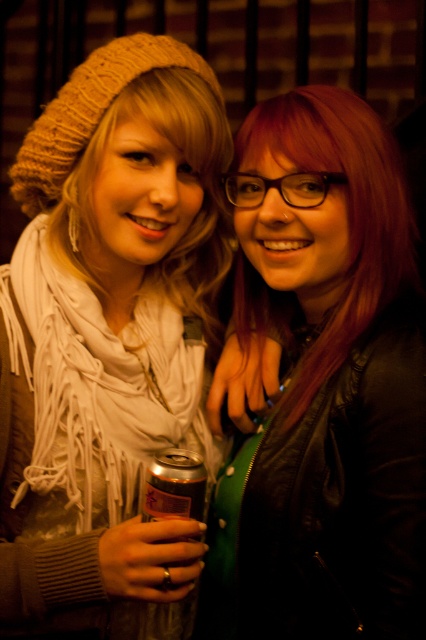
Is point (351, 148) less distant than point (178, 486)?

No, (351, 148) is further to viewer.

Who is more distant from viewer, (288, 352) or (154, 502)?

Point (288, 352)

This screenshot has height=640, width=426. In order to click on shiny black leather jacket at center in this screenshot , I will do coord(322,384).

Describe the element at coordinates (109, 336) in the screenshot. I see `knitted beige beanie at upper left` at that location.

How distant is knitted beige beanie at upper left from shiny black leather jacket at center?

knitted beige beanie at upper left and shiny black leather jacket at center are 20.32 centimeters apart from each other.

Is point (20, 540) closer to camera compared to point (319, 444)?

No, (20, 540) is behind (319, 444).

Identify the location of knitted beige beanie at upper left. click(109, 336).

Find the location of a particular element. This screenshot has width=426, height=640. knitted beige beanie at upper left is located at coordinates (109, 336).